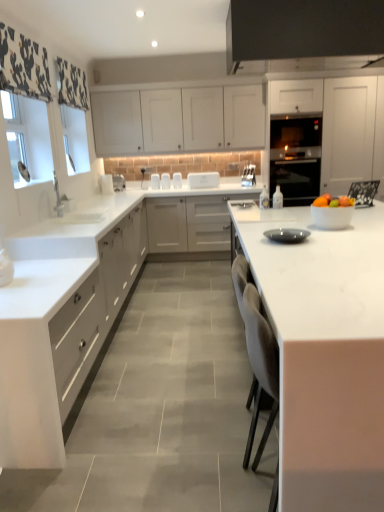
Where is `free space in front of white glossy bowl at right`? free space in front of white glossy bowl at right is located at coordinates (349, 232).